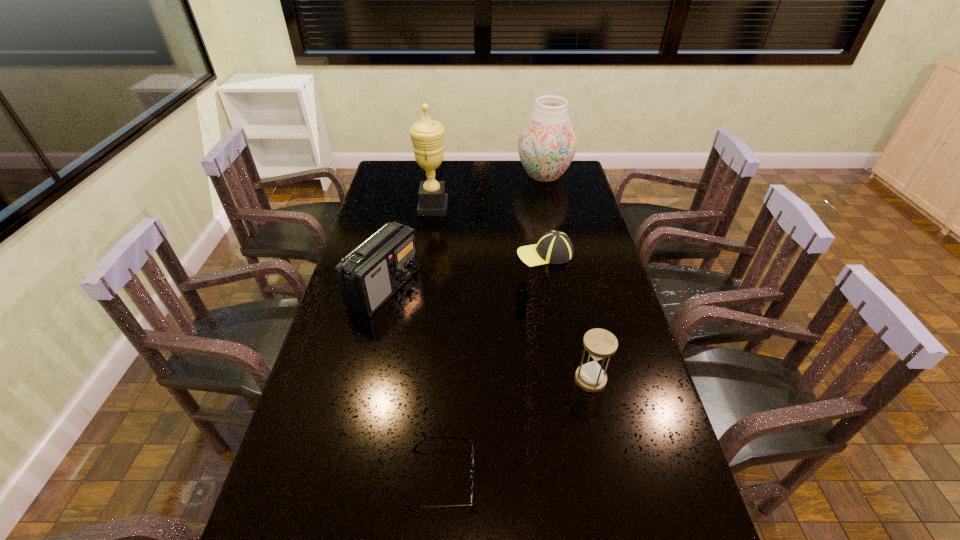
The image size is (960, 540). I want to click on the sixth nearest object, so click(x=427, y=135).

I want to click on trophy cup, so (x=427, y=135).

The image size is (960, 540). I want to click on the sixth shortest object, so click(547, 143).

The image size is (960, 540). Find the location of `vase`. vase is located at coordinates (547, 143).

Locate an element on the screen. The height and width of the screenshot is (540, 960). the fifth shortest object is located at coordinates (372, 273).

Identify the location of hourglass. [x=599, y=343].

You are a GUI agent. You are given a task and a screenshot of the screen. Output one action in this format:
    pyautogui.click(x=<x>, y=<y>)
    Task: Click on the fourth tallest object
    This screenshot has width=960, height=540.
    Given the screenshot: What is the action you would take?
    pyautogui.click(x=599, y=343)

Locate an element on the screen. The image size is (960, 540). baseball cap is located at coordinates (555, 247).

Identify the location of Lego. The height and width of the screenshot is (540, 960). (522, 294).

The image size is (960, 540). Find the location of `the shortest object`. the shortest object is located at coordinates (472, 447).